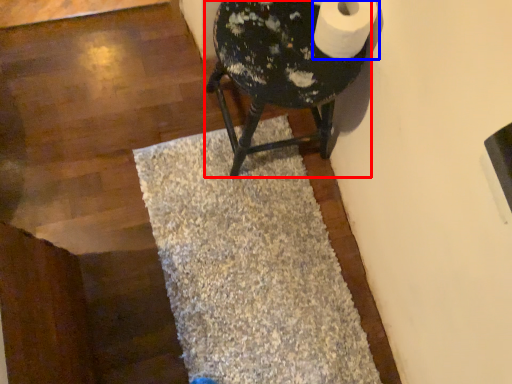
Question: Among these objects, which one is nearest to the camera, furniture (highlighted by a red box) or toilet paper (highlighted by a blue box)?

Choices:
 (A) furniture
 (B) toilet paper

Answer: (B)